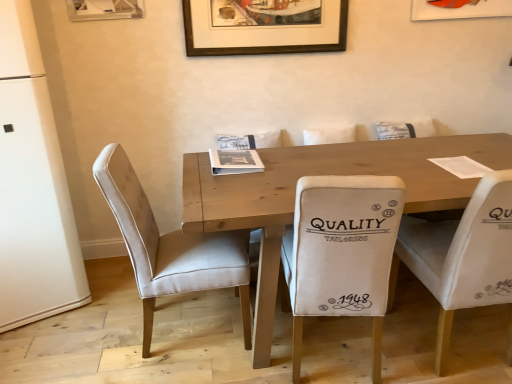
What do you see at coordinates (341, 252) in the screenshot? I see `beige fabric chair at center, the second chair in the right-to-left sequence` at bounding box center [341, 252].

The image size is (512, 384). What do you see at coordinates (461, 255) in the screenshot? I see `white fabric chair at right, acting as the 1th chair starting from the right` at bounding box center [461, 255].

Locate an element on the screen. white matte refrigerator at left is located at coordinates (32, 186).

Does white matte refrigerator at left have a lesser width compared to brown wooden picture frame at upper center?

No, white matte refrigerator at left is not thinner than brown wooden picture frame at upper center.

Is white matte refrigerator at left taller than brown wooden picture frame at upper center?

Indeed, white matte refrigerator at left has a greater height compared to brown wooden picture frame at upper center.

Does white matte refrigerator at left have a larger size compared to beige velvet chair at left, which is the first chair from left to right?

Correct, white matte refrigerator at left is larger in size than beige velvet chair at left, which is the first chair from left to right.

Consider the image. How different are the orientations of white matte refrigerator at left and beige velvet chair at left, positioned as the 3th chair in right-to-left order, in degrees?

They differ by 65.2 degrees in their facing directions.

Identify the location of fridge on the left of beige velvet chair at left, which is the first chair from left to right. (32, 186).

Considering the sizes of objects white matte refrigerator at left and beige velvet chair at left, positioned as the 3th chair in right-to-left order, in the image provided, who is taller, white matte refrigerator at left or beige velvet chair at left, positioned as the 3th chair in right-to-left order,?

With more height is white matte refrigerator at left.

Who is bigger, beige fabric chair at center, the second chair in the right-to-left sequence, or white matte refrigerator at left?

white matte refrigerator at left is bigger.

Is beige fabric chair at center, positioned as the second chair in left-to-right order, looking in the opposite direction of white matte refrigerator at left?

beige fabric chair at center, positioned as the second chair in left-to-right order, is not turned away from white matte refrigerator at left.

Which point is more distant from viewer, (349, 189) or (13, 236)?

The point (13, 236) is more distant.

Measure the distance between beige fabric chair at center, the second chair in the right-to-left sequence, and white matte refrigerator at left.

The distance of beige fabric chair at center, the second chair in the right-to-left sequence, from white matte refrigerator at left is 1.36 meters.

Between point (370, 249) and point (168, 235), which one is positioned in front?

The point (370, 249) is in front.

Which object is positioned more to the left, beige fabric chair at center, the second chair in the right-to-left sequence, or beige velvet chair at left, which is the first chair from left to right?

Positioned to the left is beige velvet chair at left, which is the first chair from left to right.

How much distance is there between beige fabric chair at center, positioned as the second chair in left-to-right order, and beige velvet chair at left, which is the first chair from left to right?

beige fabric chair at center, positioned as the second chair in left-to-right order, and beige velvet chair at left, which is the first chair from left to right, are 20.26 inches apart from each other.

Which object is more forward, beige fabric chair at center, positioned as the second chair in left-to-right order, or beige velvet chair at left, which is the first chair from left to right?

beige fabric chair at center, positioned as the second chair in left-to-right order, is more forward.

What's the angular difference between wooden table at center and white matte refrigerator at left's facing directions?

The angle between the facing direction of wooden table at center and the facing direction of white matte refrigerator at left is 24.8 degrees.

Considering the relative sizes of wooden table at center and white matte refrigerator at left in the image provided, is wooden table at center shorter than white matte refrigerator at left?

Correct, wooden table at center is not as tall as white matte refrigerator at left.

Considering the sizes of objects wooden table at center and white matte refrigerator at left in the image provided, who is thinner, wooden table at center or white matte refrigerator at left?

white matte refrigerator at left.

Looking at this image, does wooden table at center appear on the right side of white matte refrigerator at left?

Indeed, wooden table at center is positioned on the right side of white matte refrigerator at left.

Looking at this image, can you confirm if beige fabric chair at center, the second chair in the right-to-left sequence, is smaller than wooden table at center?

Yes.

Does beige fabric chair at center, the second chair in the right-to-left sequence, have a greater height compared to wooden table at center?

Indeed, beige fabric chair at center, the second chair in the right-to-left sequence, has a greater height compared to wooden table at center.

Is beige fabric chair at center, positioned as the second chair in left-to-right order, located outside wooden table at center?

Actually, beige fabric chair at center, positioned as the second chair in left-to-right order, is within wooden table at center.

In the scene shown: Is wooden table at center at the back of beige fabric chair at center, positioned as the second chair in left-to-right order?

Correct, beige fabric chair at center, positioned as the second chair in left-to-right order, is looking away from wooden table at center.

Does beige velvet chair at left, which is the first chair from left to right, have a greater height compared to brown wooden picture frame at upper center?

Indeed, beige velvet chair at left, which is the first chair from left to right, has a greater height compared to brown wooden picture frame at upper center.

Which object is further away from the camera taking this photo, beige velvet chair at left, positioned as the 3th chair in right-to-left order, or brown wooden picture frame at upper center?

brown wooden picture frame at upper center is further from the camera.

Considering the relative sizes of beige velvet chair at left, positioned as the 3th chair in right-to-left order, and brown wooden picture frame at upper center in the image provided, is beige velvet chair at left, positioned as the 3th chair in right-to-left order, bigger than brown wooden picture frame at upper center?

Yes, beige velvet chair at left, positioned as the 3th chair in right-to-left order, is bigger than brown wooden picture frame at upper center.

Which is less distant, (180,252) or (239,44)?

Point (180,252) is positioned closer to the camera compared to point (239,44).

Where is `picture frame above the white matte refrigerator at left (from the image's perspective)`? The image size is (512, 384). picture frame above the white matte refrigerator at left (from the image's perspective) is located at coordinates (264, 26).

Identify the location of chair behind the white matte refrigerator at left. This screenshot has height=384, width=512. (170, 246).

Estimate the real-world distances between objects in this image. Which object is closer to brown wooden picture frame at upper center, beige fabric chair at center, the second chair in the right-to-left sequence, or beige velvet chair at left, positioned as the 3th chair in right-to-left order?

beige velvet chair at left, positioned as the 3th chair in right-to-left order, is closer to brown wooden picture frame at upper center.

When comparing their distances from wooden table at center, does brown wooden picture frame at upper center or white fabric chair at right, acting as the 1th chair starting from the right, seem further?

Based on the image, brown wooden picture frame at upper center appears to be further to wooden table at center.

Based on their spatial positions, is white fabric chair at right, acting as the 1th chair starting from the right, or wooden table at center closer to brown wooden picture frame at upper center?

Based on the image, wooden table at center appears to be nearer to brown wooden picture frame at upper center.

When comparing their distances from white fabric chair at right, arranged as the 3th chair when viewed from the left, does wooden table at center or beige fabric chair at center, positioned as the second chair in left-to-right order, seem further?

The object further to white fabric chair at right, arranged as the 3th chair when viewed from the left, is wooden table at center.

Looking at the image, which one is located closer to white fabric chair at right, acting as the 1th chair starting from the right, beige velvet chair at left, which is the first chair from left to right, or wooden table at center?

wooden table at center is positioned closer to the anchor white fabric chair at right, acting as the 1th chair starting from the right.

Based on their spatial positions, is beige fabric chair at center, the second chair in the right-to-left sequence, or brown wooden picture frame at upper center closer to white matte refrigerator at left?

Among the two, brown wooden picture frame at upper center is located nearer to white matte refrigerator at left.

Based on their spatial positions, is white matte refrigerator at left or beige velvet chair at left, positioned as the 3th chair in right-to-left order, further from brown wooden picture frame at upper center?

white matte refrigerator at left is positioned further to the anchor brown wooden picture frame at upper center.

Based on their spatial positions, is brown wooden picture frame at upper center or wooden table at center further from beige velvet chair at left, which is the first chair from left to right?

brown wooden picture frame at upper center is positioned further to the anchor beige velvet chair at left, which is the first chair from left to right.

Locate an element on the screen. The image size is (512, 384). table between brown wooden picture frame at upper center and beige fabric chair at center, positioned as the second chair in left-to-right order, vertically is located at coordinates (324, 174).

This screenshot has height=384, width=512. In order to click on picture frame situated between white matte refrigerator at left and beige fabric chair at center, the second chair in the right-to-left sequence, from left to right in this screenshot , I will do `click(264, 26)`.

Identify the location of table between white matte refrigerator at left and white fabric chair at right, arranged as the 3th chair when viewed from the left. This screenshot has height=384, width=512. (324, 174).

Find the location of a particular element. The width and height of the screenshot is (512, 384). table located between beige velvet chair at left, which is the first chair from left to right, and white fabric chair at right, arranged as the 3th chair when viewed from the left, in the left-right direction is located at coordinates (324, 174).